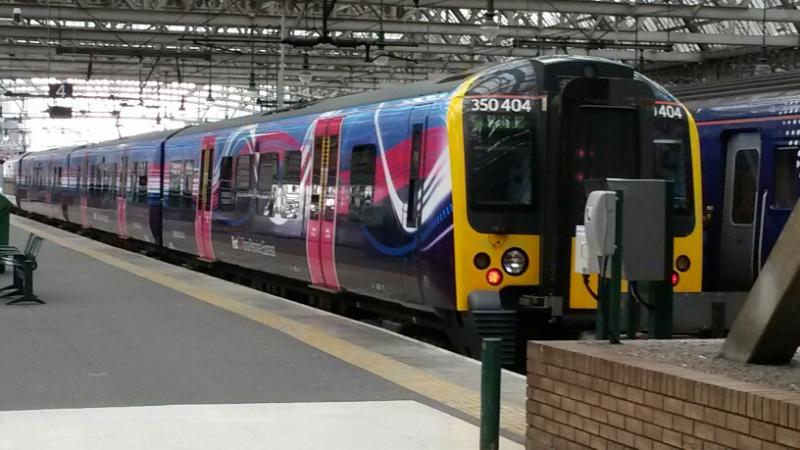
Identify the location of doors. The image size is (800, 450). tap(45, 207), tap(86, 204), tap(122, 204), tap(202, 219), tap(326, 247), tap(750, 219).